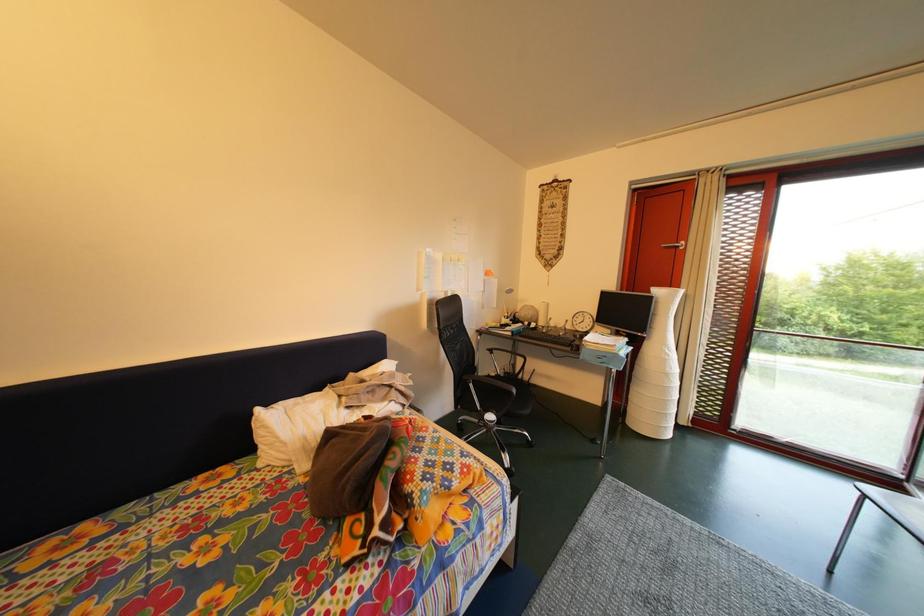
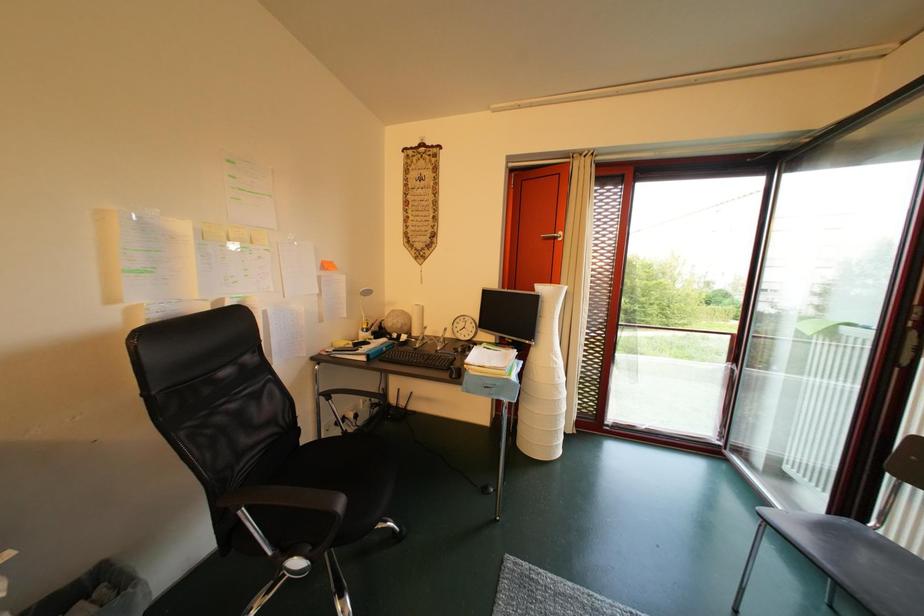
Question: The camera is either moving clockwise (left) or counter-clockwise (right) around the object. The first image is from the beginning of the video and the second image is from the end. Is the camera moving left or right when shooting the video?

Choices:
 (A) Left
 (B) Right

Answer: (A)